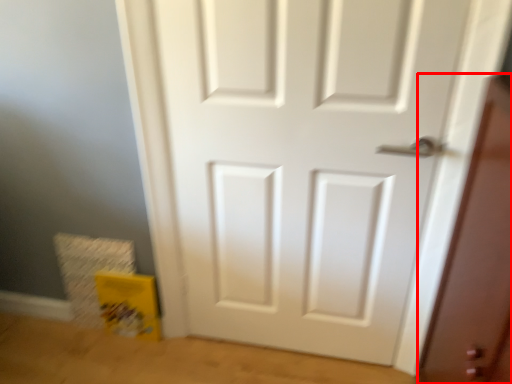
Question: Considering the relative positions of screen door (annotated by the red box) and door in the image provided, where is screen door (annotated by the red box) located with respect to the staircase?

Choices:
 (A) right
 (B) left

Answer: (A)